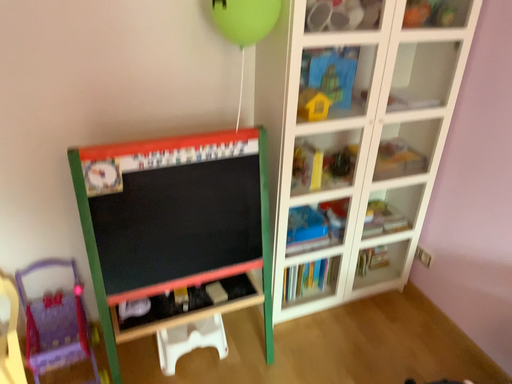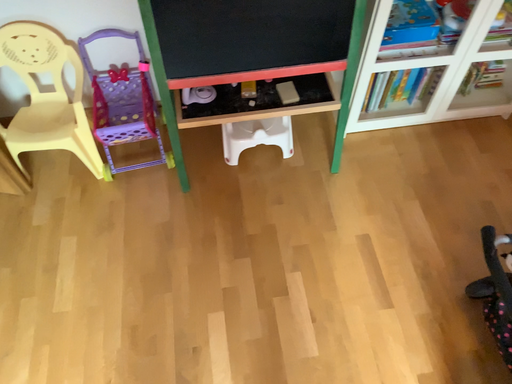
Question: Which way did the camera rotate in the video?

Choices:
 (A) rotated upward
 (B) rotated downward

Answer: (B)